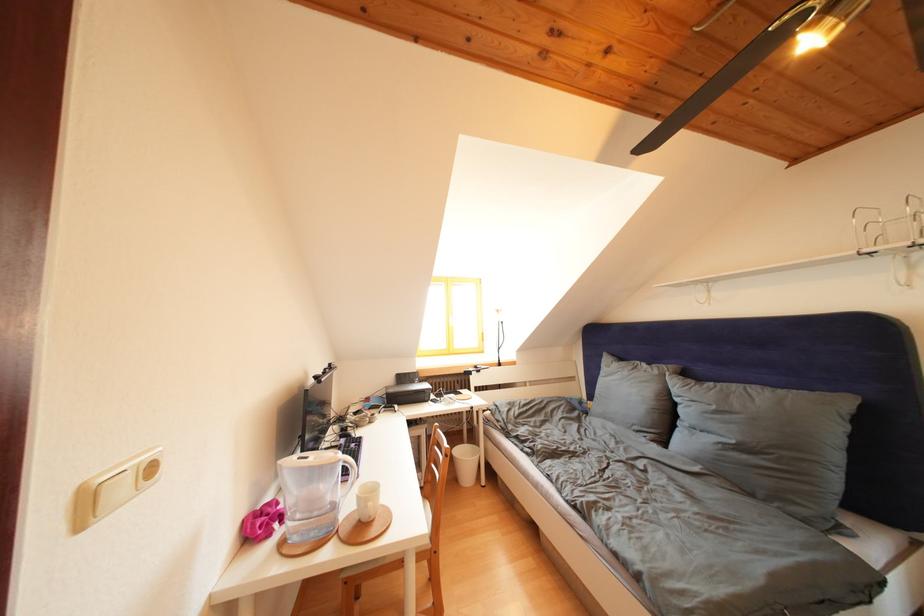
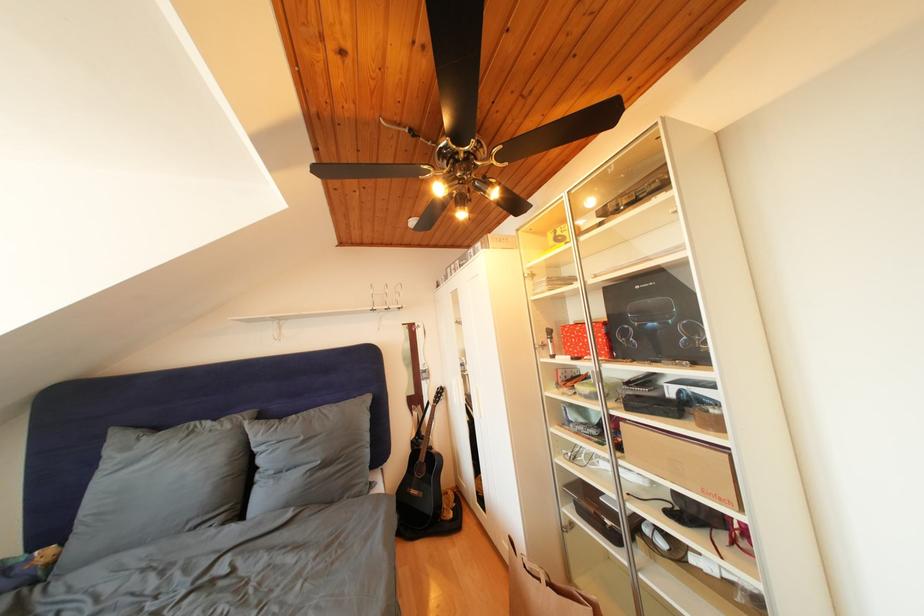
The point at [663,377] is marked in the first image. Where is the corresponding point in the second image?

(236, 432)